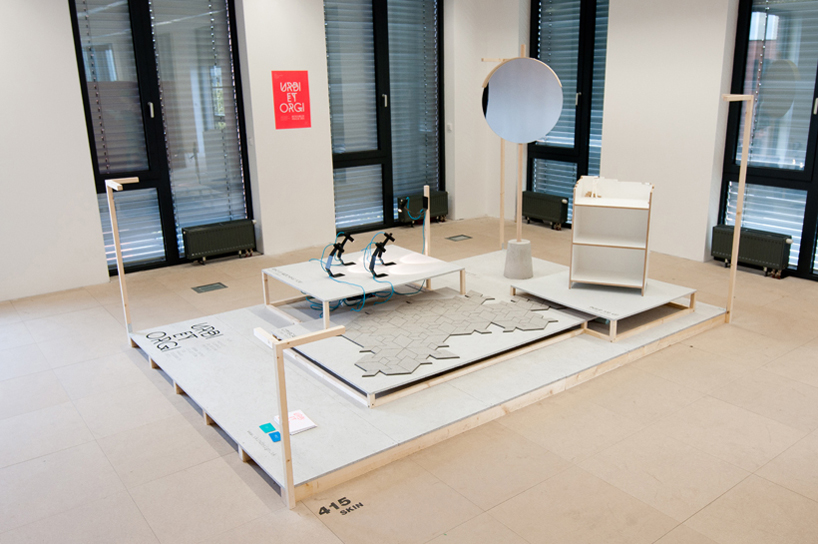
Find the location of a particular element. This screenshot has width=818, height=544. vents is located at coordinates (208, 286), (459, 236).